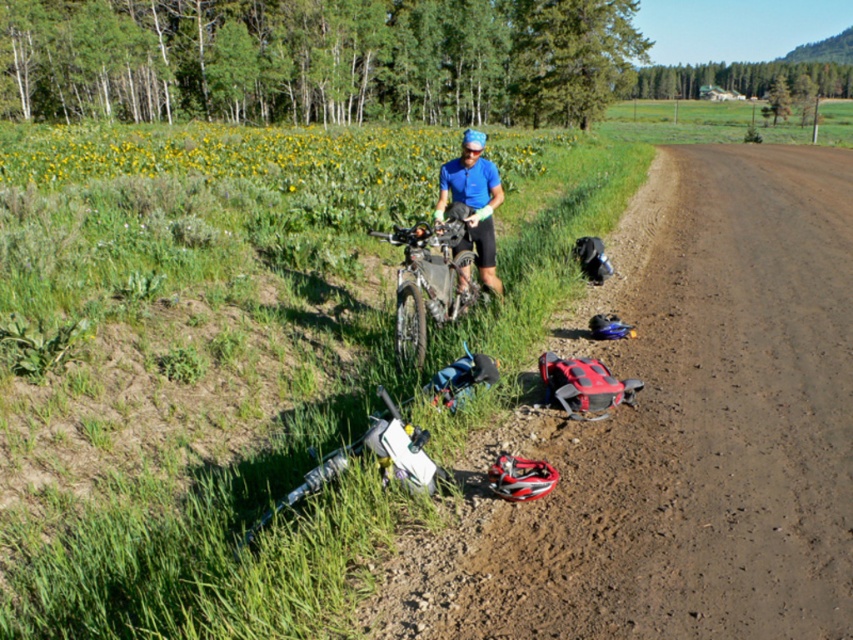
You are a hiker planning to cross the brown dirt track at lower right with your 1.5 meter wide tent. The silver metallic mountain bike at center is parked there. Can you tell me if the dirt track is wide enough to fit your tent alongside the bike?

The brown dirt track at lower right is bigger than the silver metallic mountain bike at center, so it should be wide enough to accommodate your 1.5 meter wide tent alongside the bike.

You are a hiker who wants to choose a mountain bike for a long ride. The silver metallic mountain bike at center and the white matte mountain bike at lower left are available. Which one is bigger?

The silver metallic mountain bike at center is larger in size compared to the white matte mountain bike at lower left.